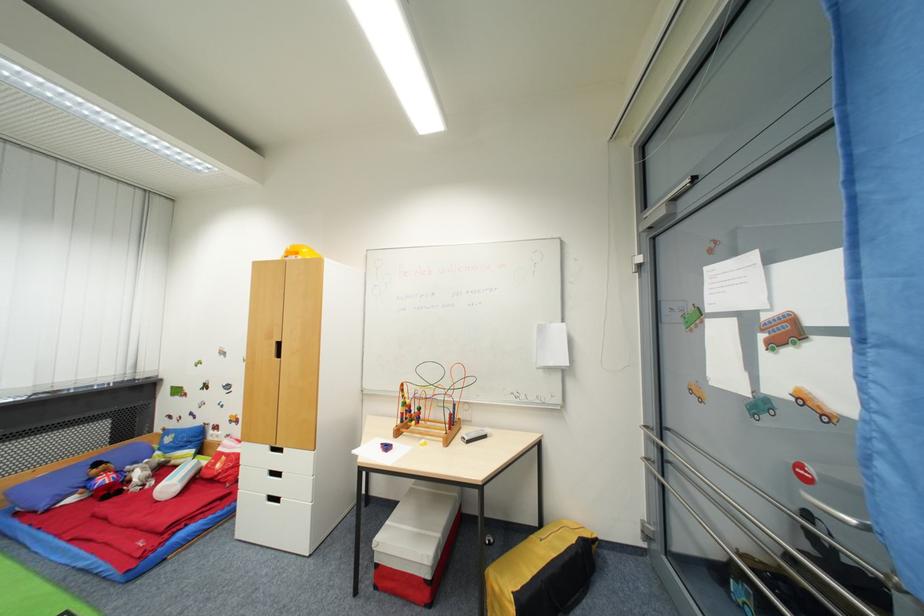
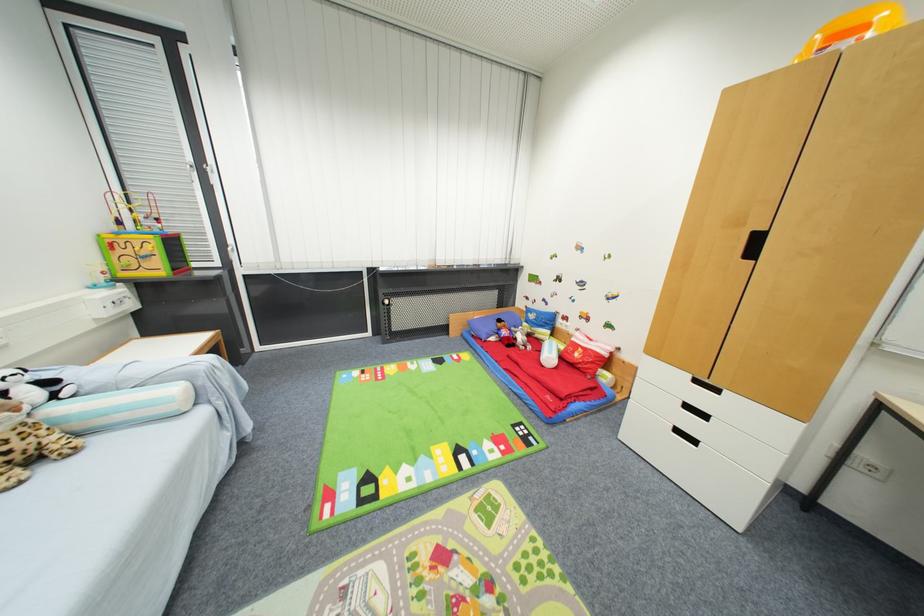
The point at (103,467) is marked in the first image. Where is the corresponding point in the second image?

(505, 323)